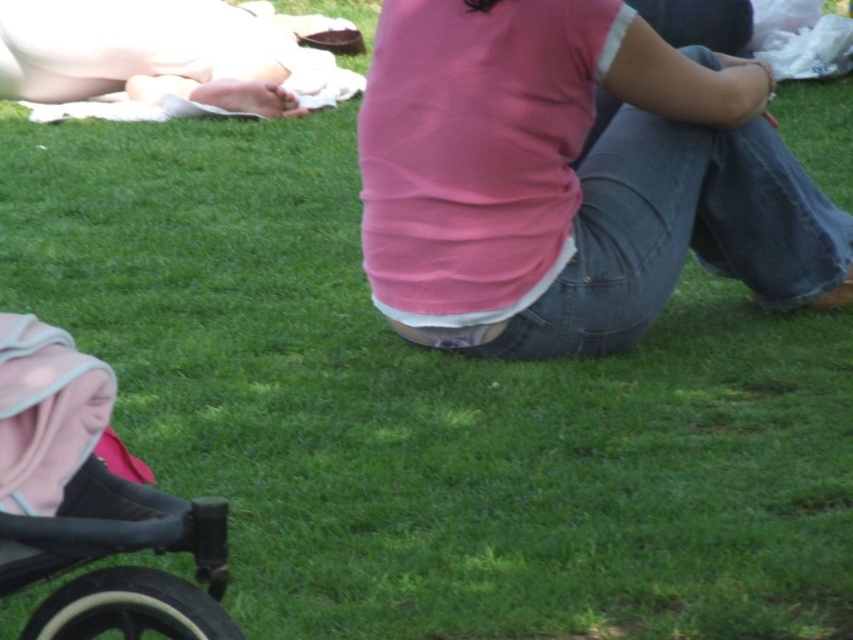
Question: Among these points, which one is nearest to the camera?

Choices:
 (A) (648, 179)
 (B) (230, 74)
 (C) (9, 429)

Answer: (C)

Question: Does pink cotton shirt at center have a lesser width compared to matte pink shirt at upper center?

Choices:
 (A) yes
 (B) no

Answer: (A)

Question: Which of these objects is positioned closest to the pink cotton shirt at center?

Choices:
 (A) black rubber baby carriage at lower left
 (B) matte pink shirt at upper center

Answer: (A)

Question: Does pink cotton shirt at center come behind black rubber baby carriage at lower left?

Choices:
 (A) no
 (B) yes

Answer: (B)

Question: Which point is closer to the camera taking this photo?

Choices:
 (A) (91, 38)
 (B) (67, 632)

Answer: (B)

Question: Does pink cotton shirt at center have a smaller size compared to black rubber baby carriage at lower left?

Choices:
 (A) no
 (B) yes

Answer: (A)